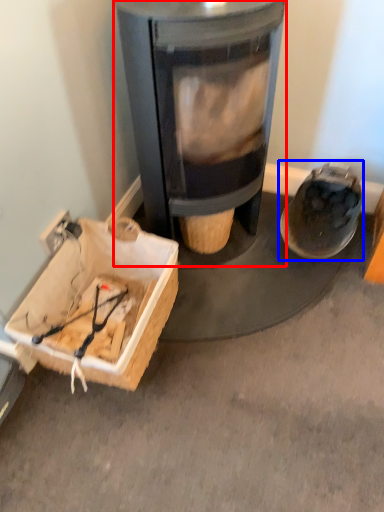
Question: Which point is closer to the camera, wood burning stove (highlighted by a red box) or footwear (highlighted by a blue box)?

Choices:
 (A) wood burning stove
 (B) footwear

Answer: (A)